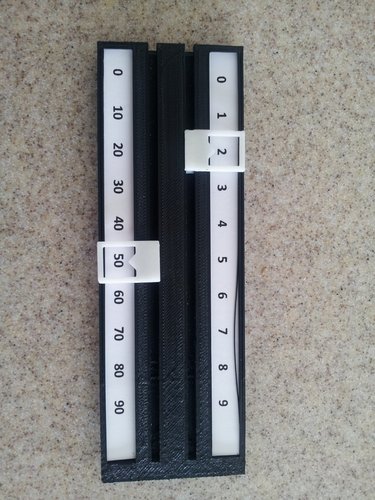
Where is `flat surface`? The image size is (375, 500). flat surface is located at coordinates (304, 292).